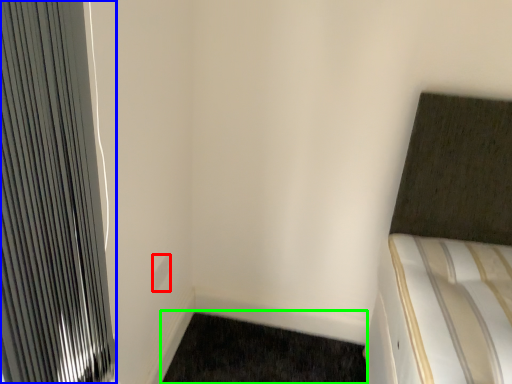
Question: Based on their relative distances, which object is farther from electric outlet (highlighted by a red box)? Choose from radiator (highlighted by a blue box) and doormat (highlighted by a green box).

Choices:
 (A) radiator
 (B) doormat

Answer: (A)